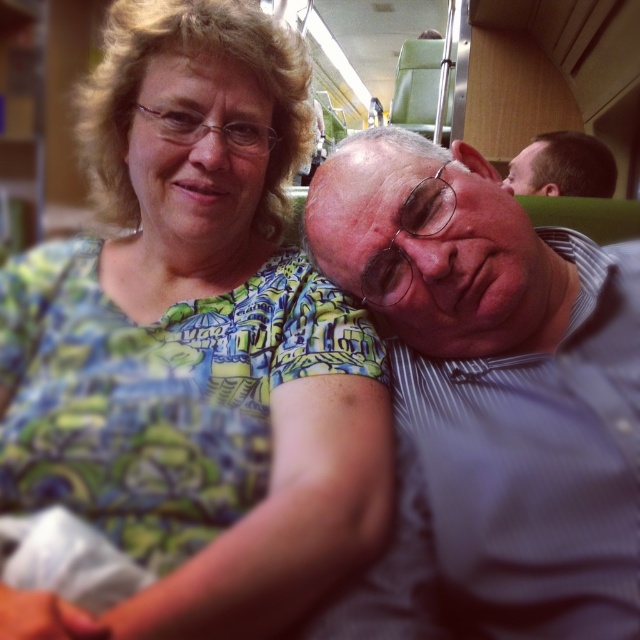
Question: Estimate the real-world distances between objects in this image. Which object is closer to the matte gray shirt at center?

Choices:
 (A) green printed fabric at upper left
 (B) brown hair at upper right

Answer: (A)

Question: Does green printed fabric at upper left have a greater width compared to matte gray shirt at center?

Choices:
 (A) yes
 (B) no

Answer: (A)

Question: Which point is closer to the camera taking this photo?

Choices:
 (A) (240, 369)
 (B) (426, 390)
 (C) (572, 147)

Answer: (B)

Question: Which of the following is the farthest from the observer?

Choices:
 (A) (460, 364)
 (B) (563, 182)
 (C) (157, 616)

Answer: (B)

Question: Is green printed fabric at upper left to the right of brown hair at upper right from the viewer's perspective?

Choices:
 (A) yes
 (B) no

Answer: (B)

Question: Can you confirm if green printed fabric at upper left is positioned below brown hair at upper right?

Choices:
 (A) yes
 (B) no

Answer: (A)